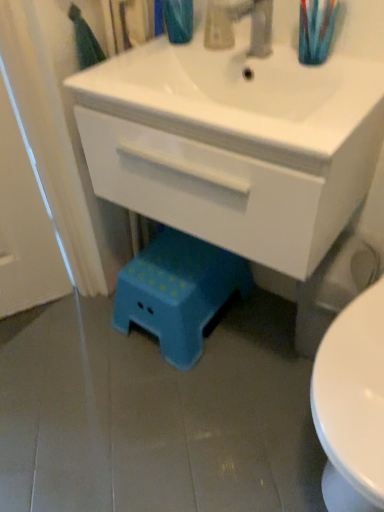
Locate an element on the screen. free space in front of blue plastic step stool at lower center is located at coordinates (184, 403).